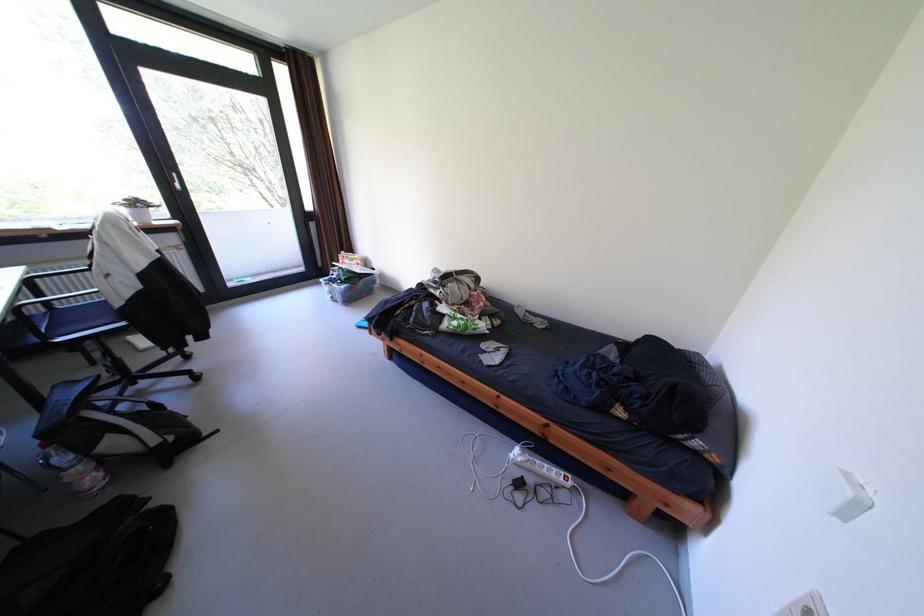
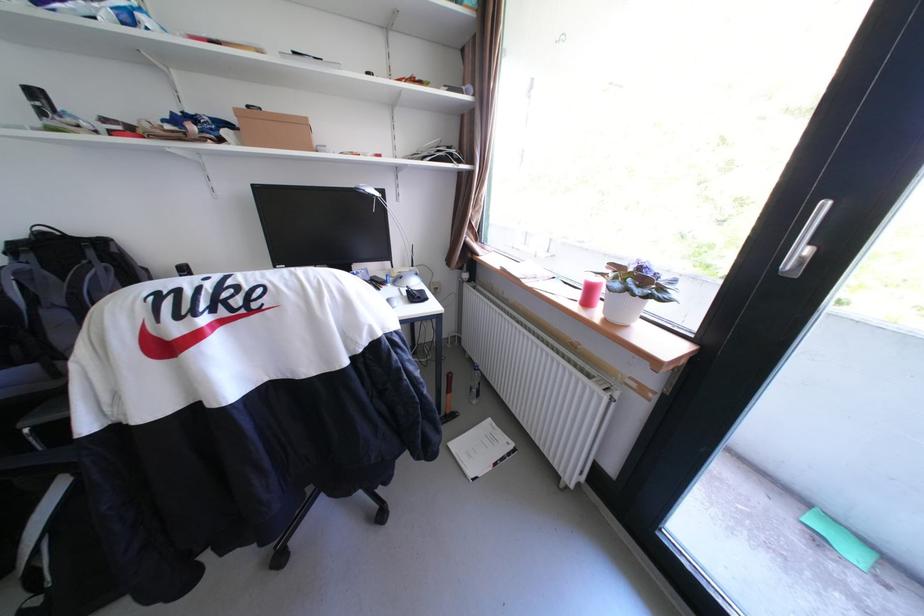
The point at (144,225) is marked in the first image. Where is the corresponding point in the second image?

(608, 313)